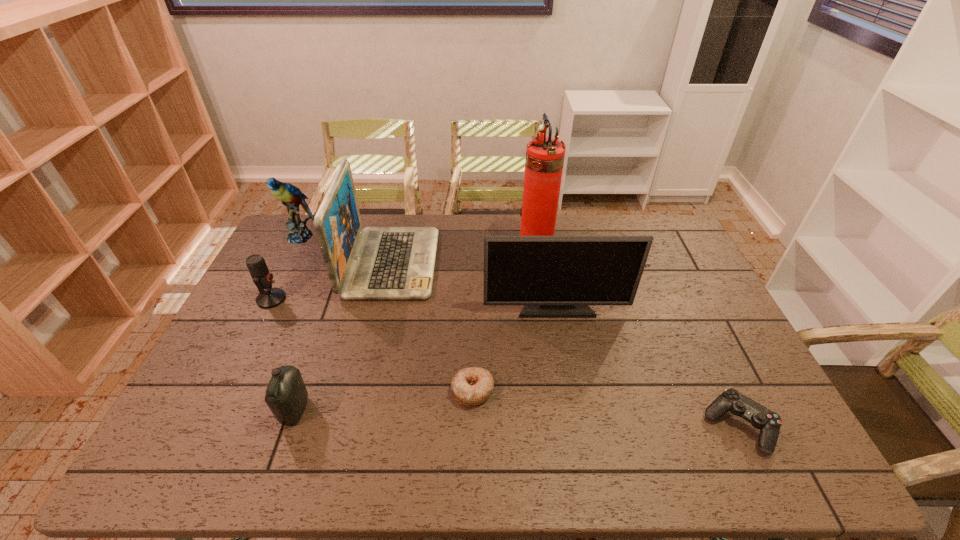
You are a GUI agent. You are given a task and a screenshot of the screen. Output one action in this format:
    pyautogui.click(x=<x>, y=<y>)
    Task: Click on the fire extinguisher
    This screenshot has width=960, height=540.
    Given the screenshot: What is the action you would take?
    pyautogui.click(x=544, y=161)

The width and height of the screenshot is (960, 540). I want to click on laptop computer, so click(x=375, y=263).

Where is `monitor`? The height and width of the screenshot is (540, 960). monitor is located at coordinates (553, 276).

This screenshot has width=960, height=540. Find the location of `parrot`. parrot is located at coordinates (291, 197).

This screenshot has width=960, height=540. I want to click on microphone, so click(x=271, y=297).

What are the coordinates of `bottle` in the screenshot? It's located at (x=286, y=395).

Where is `the second shortest object`? the second shortest object is located at coordinates (769, 423).

At what (x,y) coordinates should I click in order to perform the action: click on the rightmost object. Please return your answer as a coordinate pair (x, y). Looking at the image, I should click on (769, 423).

The height and width of the screenshot is (540, 960). In order to click on doughnut in this screenshot , I will do (470, 386).

The image size is (960, 540). In order to click on vacant region located at the discharge end of the fire extinguisher in this screenshot , I will do `click(423, 249)`.